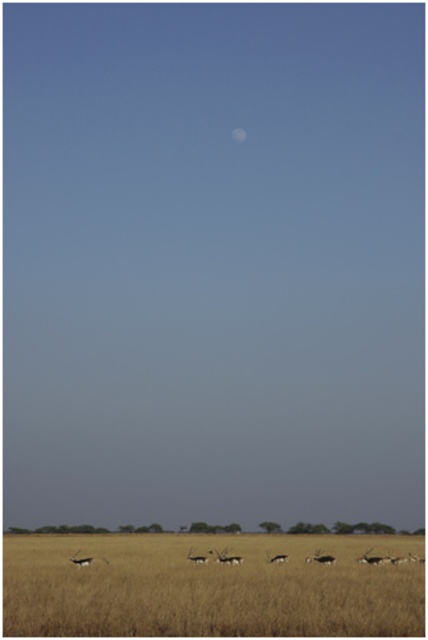
Question: Which object is farther from the camera taking this photo?

Choices:
 (A) white matte moon at upper center
 (B) smooth brown antelope at lower left
 (C) white glossy antelope at center

Answer: (A)

Question: Can you confirm if smooth brown antelope at lower left is bigger than white matte moon at upper center?

Choices:
 (A) no
 (B) yes

Answer: (B)

Question: Which point is closer to the camera?

Choices:
 (A) (207, 561)
 (B) (237, 129)

Answer: (A)

Question: Which point is farther to the camera?

Choices:
 (A) (76, 563)
 (B) (199, 561)

Answer: (B)

Question: Does smooth brown antelope at lower left come in front of brown textured antelope at center?

Choices:
 (A) no
 (B) yes

Answer: (B)

Question: Does brown grassland at lower center come behind white glossy antelope at center?

Choices:
 (A) yes
 (B) no

Answer: (A)